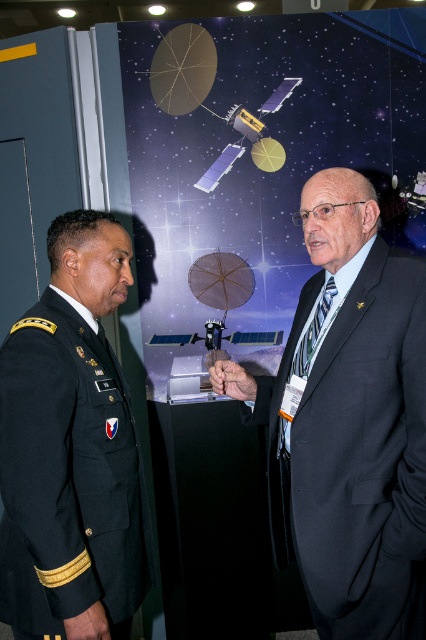
Is dark green military uniform at left above smooth skin hand at center?

Actually, dark green military uniform at left is below smooth skin hand at center.

What do you see at coordinates (71, 449) in the screenshot? This screenshot has height=640, width=426. I see `dark green military uniform at left` at bounding box center [71, 449].

I want to click on dark green military uniform at left, so click(71, 449).

The height and width of the screenshot is (640, 426). In order to click on dark green military uniform at left in this screenshot , I will do `click(71, 449)`.

Does dark blue suit at center appear over dark green military uniform at left?

Correct, dark blue suit at center is located above dark green military uniform at left.

Is dark blue suit at center closer to camera compared to dark green military uniform at left?

No.

Describe the element at coordinates (353, 419) in the screenshot. The height and width of the screenshot is (640, 426). I see `dark blue suit at center` at that location.

Identify the location of dark blue suit at center. (353, 419).

Does dark blue suit at center lie in front of smooth skin hand at center?

Yes.

Between point (357, 627) and point (213, 387), which one is positioned behind?

Positioned behind is point (213, 387).

Is point (336, 429) less distant than point (247, 397)?

Yes.

Where is `dark blue suit at center`? The image size is (426, 640). dark blue suit at center is located at coordinates (353, 419).